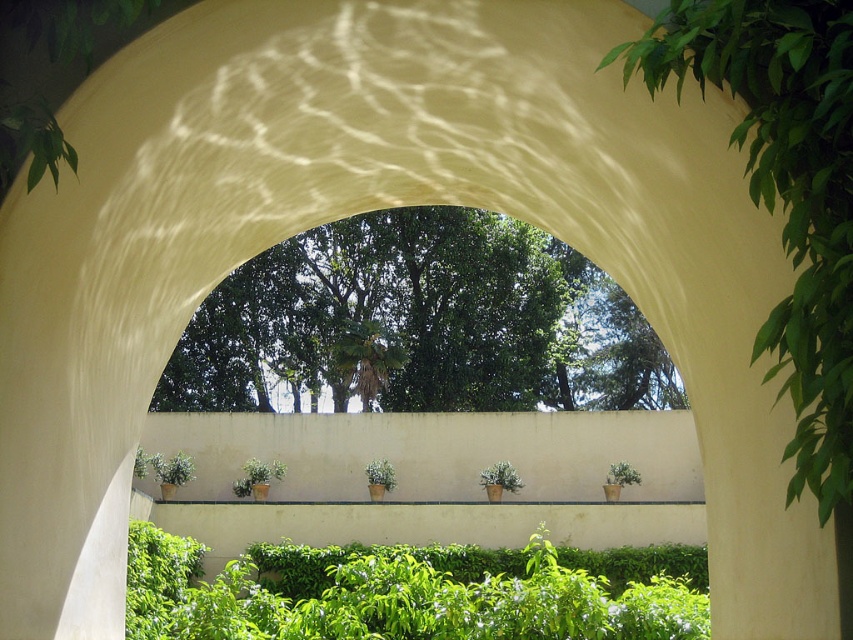
Question: Which point is farther to the camera?

Choices:
 (A) (256, 483)
 (B) (375, 605)
 (C) (440, 220)
 (D) (819, 436)

Answer: (C)

Question: Is green leafy tree at right positioned behind green matte plant at center?

Choices:
 (A) no
 (B) yes

Answer: (A)

Question: Is green leafy tree at center closer to camera compared to green matte plant at center?

Choices:
 (A) no
 (B) yes

Answer: (A)

Question: Which of the following is the closest to the observer?

Choices:
 (A) green leafy hedge at center
 (B) green leafy tree at right
 (C) green leafy tree at center

Answer: (B)

Question: Does green leafy tree at center lie in front of green leafy tree at right?

Choices:
 (A) no
 (B) yes

Answer: (A)

Question: Estimate the real-world distances between objects in this image. Which object is farther from the green leafy hedge at center?

Choices:
 (A) green matte plant at center
 (B) green leafy tree at right
 (C) green leafy tree at center

Answer: (C)